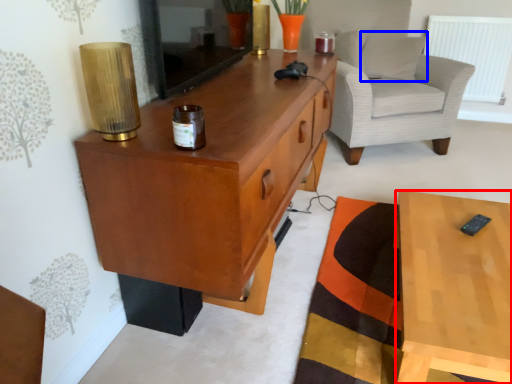
Question: Which object appears closest to the camera in this image, desk (highlighted by a red box) or pillow (highlighted by a blue box)?

Choices:
 (A) desk
 (B) pillow

Answer: (A)